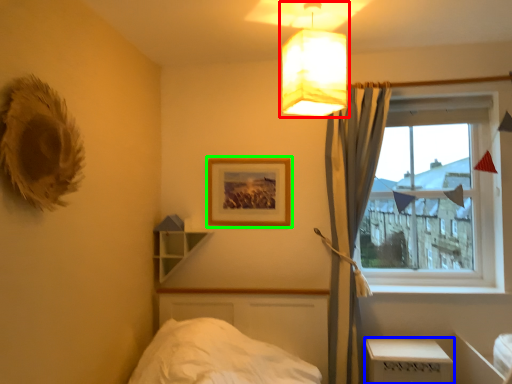
Question: Considering the real-world distances, which object is closest to lamp (highlighted by a red box)? table (highlighted by a blue box) or picture frame (highlighted by a green box).

Choices:
 (A) table
 (B) picture frame

Answer: (B)